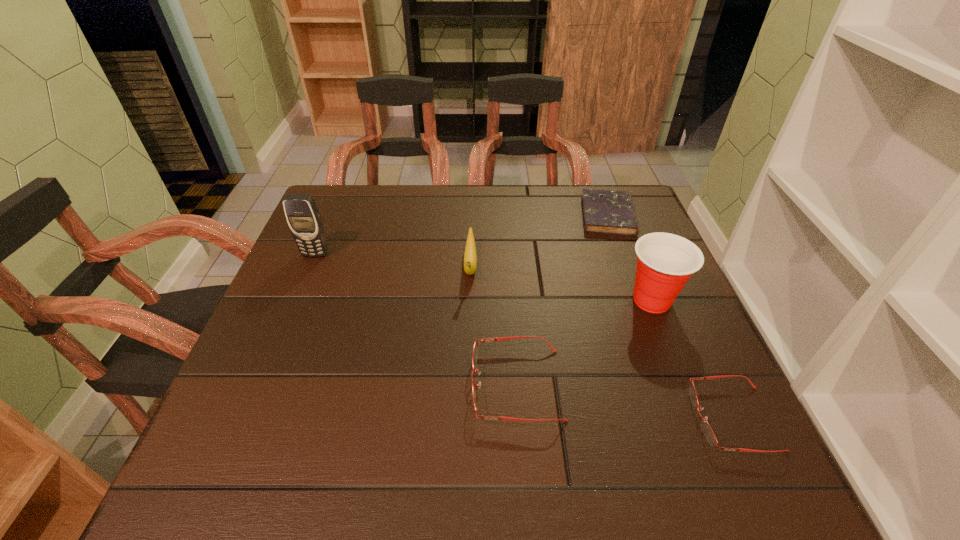
Image resolution: width=960 pixels, height=540 pixels. What are the coordinates of `object that is at the far edge` in the screenshot? It's located at [x=604, y=211].

Find the location of a particular element. The image size is (960, 540). object present at the left edge is located at coordinates (303, 217).

Locate an element on the screen. The width and height of the screenshot is (960, 540). spectacles present at the right edge is located at coordinates (707, 430).

You are a GUI agent. You are given a task and a screenshot of the screen. Output one action in this format:
    pyautogui.click(x=<x>, y=<y>)
    Task: Click on the diary situated at the right edge
    
    Given the screenshot: What is the action you would take?
    pyautogui.click(x=604, y=211)

Where is `cup present at the right edge`? This screenshot has height=540, width=960. cup present at the right edge is located at coordinates (665, 261).

Identify the location of object located at the far right corner. This screenshot has width=960, height=540. (604, 211).

The height and width of the screenshot is (540, 960). I want to click on object that is at the near right corner, so click(707, 430).

Locate an element on the screen. Image resolution: width=960 pixels, height=540 pixels. blank area at the far edge is located at coordinates (574, 195).

In order to click on blank area at the near edge in this screenshot , I will do `click(342, 406)`.

This screenshot has width=960, height=540. Find the location of `vacant region at the left edge`. vacant region at the left edge is located at coordinates click(340, 266).